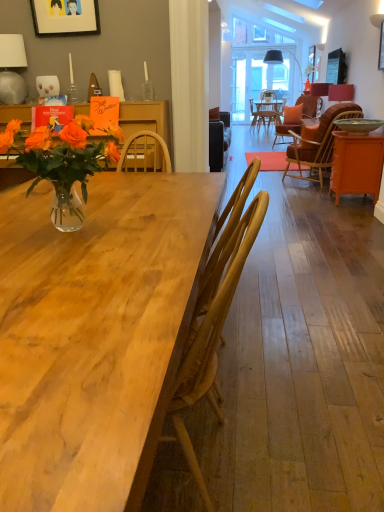
Question: From the image's perspective, is translucent glass vase at left located above orange woven chair at right, arranged as the 1th chair when viewed from the right?

Choices:
 (A) yes
 (B) no

Answer: (B)

Question: Are translucent glass vase at left and orange woven chair at right, which appears as the second chair when ordered from the bottom, far apart?

Choices:
 (A) no
 (B) yes

Answer: (B)

Question: Does translucent glass vase at left have a smaller size compared to orange woven chair at right, which is the second chair in front-to-back order?

Choices:
 (A) no
 (B) yes

Answer: (B)

Question: Could you tell me if translucent glass vase at left is turned towards orange woven chair at right, which is the second chair in front-to-back order?

Choices:
 (A) no
 (B) yes

Answer: (A)

Question: From a real-world perspective, is translucent glass vase at left located beneath orange woven chair at right, marked as the 1th chair in a top-to-bottom arrangement?

Choices:
 (A) no
 (B) yes

Answer: (A)

Question: Does point (329, 87) appear closer or farther from the camera than point (51, 178)?

Choices:
 (A) closer
 (B) farther

Answer: (B)

Question: Relative to translucent glass vase at left, is matte red lampshade at upper right, which ranks as the first lamp in back-to-front order, in front or behind?

Choices:
 (A) front
 (B) behind

Answer: (B)

Question: Choose the correct answer: Is matte red lampshade at upper right, the 1th lamp positioned from the right, inside translucent glass vase at left or outside it?

Choices:
 (A) outside
 (B) inside

Answer: (A)

Question: Based on their positions, is matte red lampshade at upper right, the 1th lamp positioned from the right, located to the left or right of translucent glass vase at left?

Choices:
 (A) left
 (B) right

Answer: (B)

Question: Is white ceramic lamp at upper left, which is counted as the first lamp, starting from the bottom, wider or thinner than orange woven chair at right, which appears as the second chair when ordered from the bottom?

Choices:
 (A) wide
 (B) thin

Answer: (B)

Question: In the image, is white ceramic lamp at upper left, which is counted as the first lamp, starting from the bottom, positioned in front of or behind orange woven chair at right, marked as the 1th chair in a top-to-bottom arrangement?

Choices:
 (A) front
 (B) behind

Answer: (A)

Question: From the image's perspective, is white ceramic lamp at upper left, placed as the first lamp when sorted from front to back, located above or below orange woven chair at right, placed as the first chair when sorted from back to front?

Choices:
 (A) below
 (B) above

Answer: (B)

Question: Considering the positions of white ceramic lamp at upper left, arranged as the second lamp when viewed from the right, and orange woven chair at right, placed as the first chair when sorted from back to front, in the image, is white ceramic lamp at upper left, arranged as the second lamp when viewed from the right, taller or shorter than orange woven chair at right, placed as the first chair when sorted from back to front,?

Choices:
 (A) tall
 (B) short

Answer: (B)

Question: Looking at their shapes, would you say white ceramic lamp at upper left, which appears as the 1th lamp when viewed from the left, is wider or thinner than wooden picture frame at upper right, which ranks as the second picture frame in front-to-back order?

Choices:
 (A) wide
 (B) thin

Answer: (A)

Question: From the image's perspective, is white ceramic lamp at upper left, acting as the 2th lamp starting from the back, located above or below wooden picture frame at upper right, which ranks as the second picture frame in front-to-back order?

Choices:
 (A) below
 (B) above

Answer: (A)